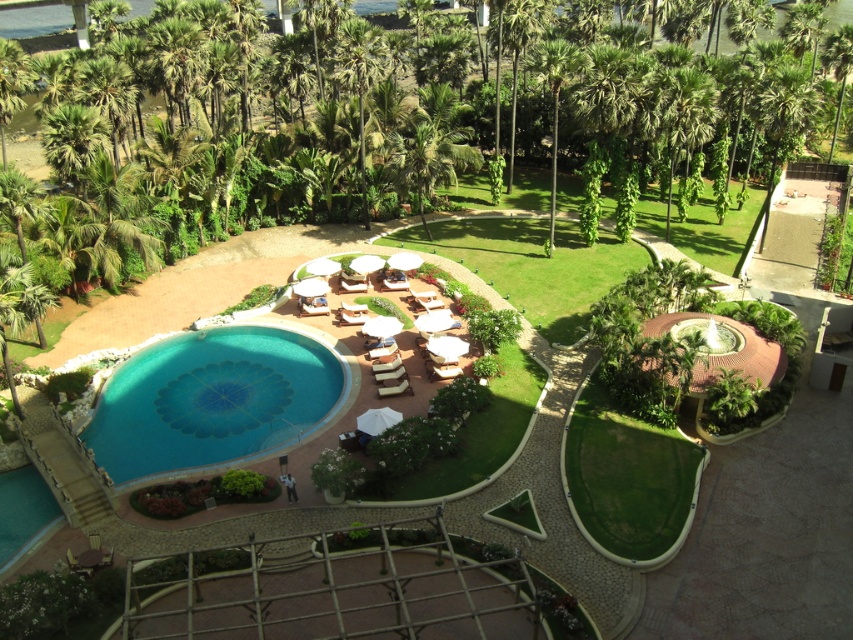
Does teal glossy pool at center have a lesser width compared to green leafy palm tree at center?

No, teal glossy pool at center is not thinner than green leafy palm tree at center.

Does teal glossy pool at center have a smaller size compared to green leafy palm tree at center?

Indeed, teal glossy pool at center has a smaller size compared to green leafy palm tree at center.

You are a GUI agent. You are given a task and a screenshot of the screen. Output one action in this format:
    pyautogui.click(x=<x>, y=<y>)
    Task: Click on the teal glossy pool at center
    
    Given the screenshot: What is the action you would take?
    pyautogui.click(x=212, y=400)

Looking at this image, how distant is green leafy palm tree at upper center from green leafy palm tree at center?

15.33 feet

The image size is (853, 640). Identify the location of green leafy palm tree at upper center. pos(519,44).

Who is positioned more to the right, teal glossy pool at center or green leafy palm tree at upper center?

green leafy palm tree at upper center

Can you confirm if teal glossy pool at center is wider than green leafy palm tree at upper center?

Correct, the width of teal glossy pool at center exceeds that of green leafy palm tree at upper center.

In order to click on teal glossy pool at center in this screenshot , I will do `click(212, 400)`.